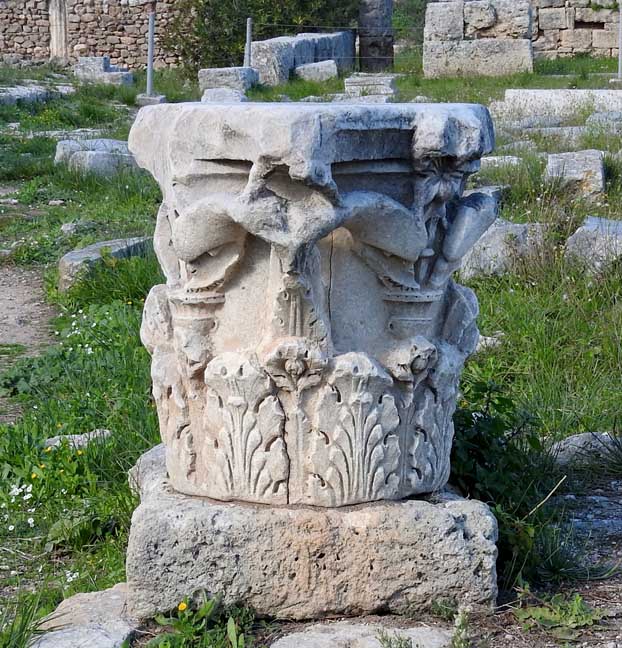
Identify the location of cube wall. The image size is (622, 648). (578, 41), (547, 19), (604, 30), (480, 50), (476, 17).